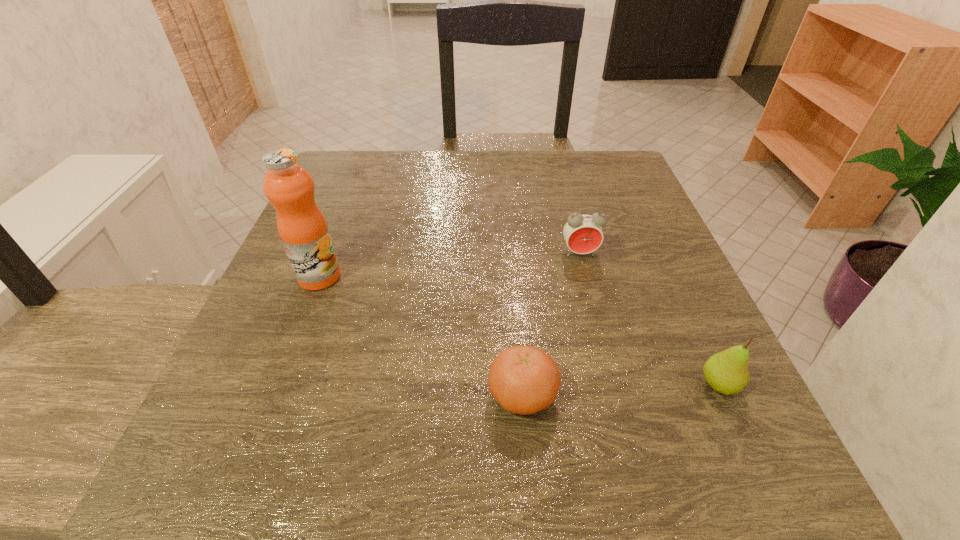
Find the location of a particular element. The image size is (960, 540). the tallest object is located at coordinates (289, 187).

Locate an element on the screen. This screenshot has height=540, width=960. fruit juice is located at coordinates (289, 187).

At what (x,y) coordinates should I click in order to perform the action: click on alarm clock. Please return your answer as a coordinate pair (x, y). Looking at the image, I should click on pos(583,233).

Where is `the farthest object`? This screenshot has width=960, height=540. the farthest object is located at coordinates (583, 233).

Identify the location of pear. (726, 372).

Locate an element on the screen. clementine is located at coordinates (524, 380).

I want to click on the shortest object, so click(x=524, y=380).

The height and width of the screenshot is (540, 960). Identify the location of vacant space situated on the front of the fruit juice. (244, 470).

You are a GUI agent. You are given a task and a screenshot of the screen. Output one action in this format:
    pyautogui.click(x=<x>, y=<y>)
    Task: Click on the free point located on the face of the farthest object
    
    Given the screenshot: What is the action you would take?
    pyautogui.click(x=589, y=293)

Find the location of a particular element. vacant space positioned on the back of the rightmost object is located at coordinates (652, 239).